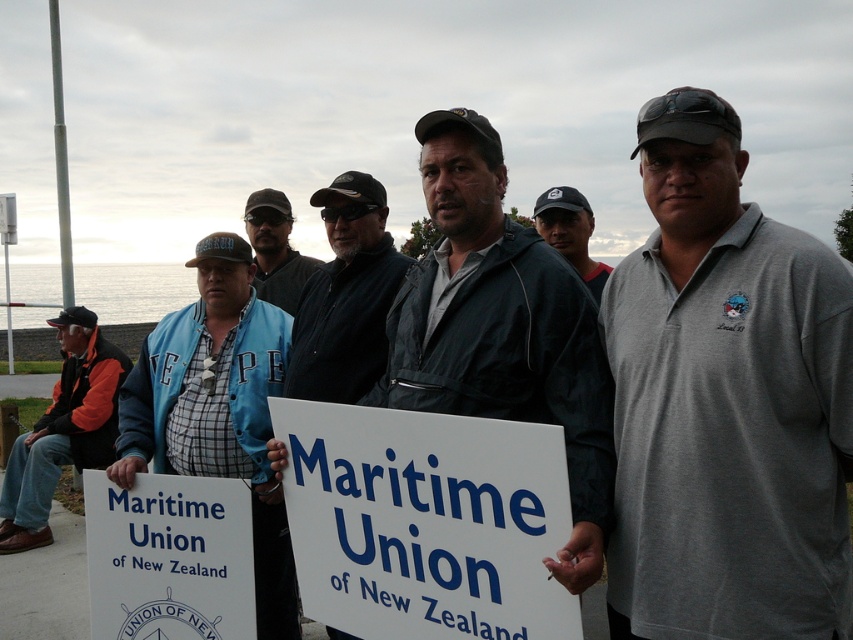
Which is more to the right, dark blue jacket at center or orange fleece jacket at left?

dark blue jacket at center

The image size is (853, 640). In order to click on dark blue jacket at center in this screenshot , I will do `click(346, 296)`.

Can you confirm if white paper sign at center is positioned below blue denim jacket at center?

Indeed, white paper sign at center is positioned under blue denim jacket at center.

Does white paper sign at center have a smaller size compared to blue denim jacket at center?

Incorrect, white paper sign at center is not smaller in size than blue denim jacket at center.

Between point (555, 589) and point (253, 284), which one is positioned behind?

The point (253, 284) is behind.

The image size is (853, 640). I want to click on white paper sign at center, so click(x=425, y=522).

Does point (399, 420) come behind point (509, 298)?

No, (399, 420) is in front of (509, 298).

Does white paper sign at center appear under dark gray jacket at center?

Yes.

Is point (373, 612) closer to viewer compared to point (537, 266)?

No.

Find the location of a particular element. The height and width of the screenshot is (640, 853). white paper sign at center is located at coordinates (425, 522).